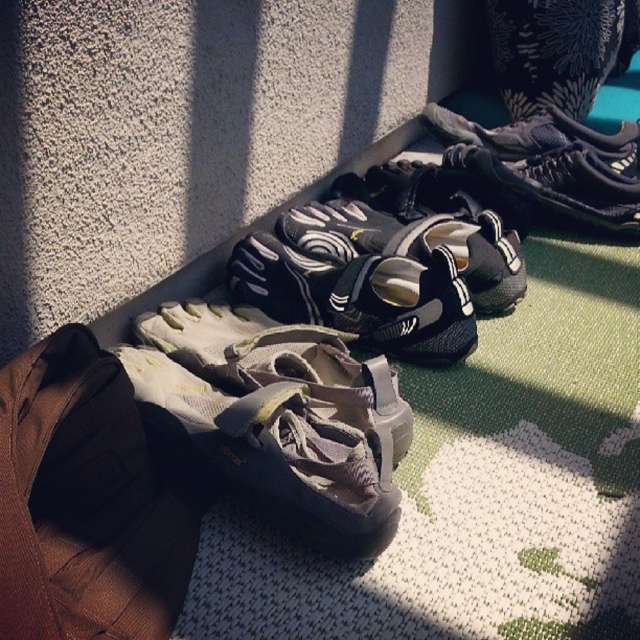
You are standing in a room where the footwear is arranged as described. You want to pick up the gray suede sandal at center without moving the black mesh shoe at center. Is this possible based on their positions?

The gray suede sandal at center is below the black mesh shoe at center, so you can pick up the gray suede sandal at center without moving the black mesh shoe at center since it is positioned underneath.

You are organizing a shoe rack and need to place the gray suede sandal at center and the black mesh shoe at center next to each other. Based on their sizes, which one should you place first to ensure they fit properly?

The gray suede sandal at center occupies less space than the black mesh shoe at center, so you should place the black mesh shoe at center first to accommodate its larger size before placing the smaller gray suede sandal at center.

You are standing in a room where the footwear is arranged on the floor. You notice a specific point marked at coordinates (276, 451). Which footwear item is this point located on?

The point at (276, 451) is located on the gray suede sandal at center.